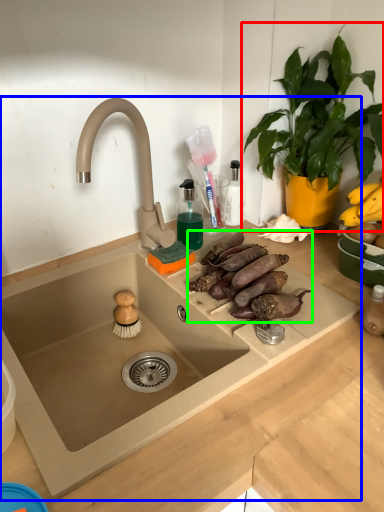
Question: Which object is the farthest from houseplant (highlighted by a red box)? Choose among these: sink (highlighted by a blue box) or food (highlighted by a green box).

Choices:
 (A) sink
 (B) food

Answer: (A)